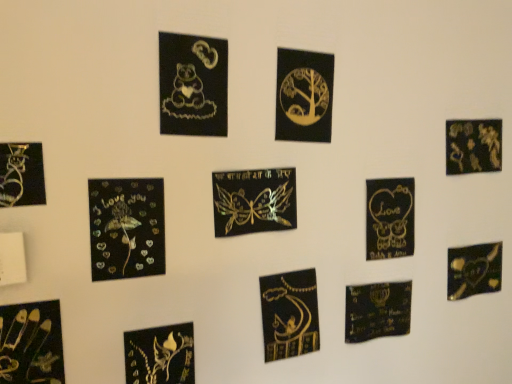
Question: Is metallic gold butterfly at lower left, the 6th picture frame from the right, looking in the opposite direction of gold metallic calligraphy at center, the second embroidery from the back?

Choices:
 (A) no
 (B) yes

Answer: (A)

Question: Is metallic gold butterfly at lower left, the fourth picture frame when ordered from left to right, aimed at gold metallic calligraphy at center, the second embroidery from the back?

Choices:
 (A) yes
 (B) no

Answer: (B)

Question: Would you consider metallic gold butterfly at lower left, the 6th picture frame from the right, to be distant from gold metallic calligraphy at center, the 2th embroidery when ordered from right to left?

Choices:
 (A) yes
 (B) no

Answer: (B)

Question: Would you say metallic gold butterfly at lower left, the fourth picture frame when ordered from left to right, contains gold metallic calligraphy at center, the second embroidery from the back?

Choices:
 (A) yes
 (B) no

Answer: (B)

Question: Can you confirm if metallic gold butterfly at lower left, the 6th picture frame from the right, is wider than gold metallic calligraphy at center, which appears as the 1th embroidery when viewed from the front?

Choices:
 (A) no
 (B) yes

Answer: (A)

Question: Is gold metallic heart at center right, positioned as the second picture frame in right-to-left order, taller or shorter than holographic gold butterflies at center, the 4th picture frame positioned from the right?

Choices:
 (A) tall
 (B) short

Answer: (A)

Question: From a real-world perspective, is gold metallic heart at center right, positioned as the second picture frame in right-to-left order, physically located above or below holographic gold butterflies at center, arranged as the sixth picture frame when viewed from the left?

Choices:
 (A) above
 (B) below

Answer: (B)

Question: In terms of size, does gold metallic heart at center right, placed as the 8th picture frame when sorted from left to right, appear bigger or smaller than holographic gold butterflies at center, the 4th picture frame positioned from the right?

Choices:
 (A) big
 (B) small

Answer: (B)

Question: Choose the correct answer: Is gold metallic heart at center right, positioned as the second picture frame in right-to-left order, inside holographic gold butterflies at center, arranged as the sixth picture frame when viewed from the left, or outside it?

Choices:
 (A) outside
 (B) inside

Answer: (A)

Question: From their relative heights in the image, would you say metallic gold floral design at upper right, which is the 9th picture frame in left-to-right order, is taller or shorter than gold metallic heart at center right, placed as the 8th picture frame when sorted from left to right?

Choices:
 (A) tall
 (B) short

Answer: (B)

Question: Considering their positions, is metallic gold floral design at upper right, the 1th picture frame when ordered from right to left, located in front of or behind gold metallic heart at center right, placed as the 8th picture frame when sorted from left to right?

Choices:
 (A) behind
 (B) front

Answer: (A)

Question: Is point (497, 147) closer or farther from the camera than point (394, 228)?

Choices:
 (A) farther
 (B) closer

Answer: (A)

Question: Do you think metallic gold floral design at upper right, which is the 9th picture frame in left-to-right order, is within gold metallic heart at center right, placed as the 8th picture frame when sorted from left to right, or outside of it?

Choices:
 (A) inside
 (B) outside

Answer: (B)

Question: From a real-world perspective, is matte black heart at lower center, the 1th embroidery from the right, above or below gold metallic tree at upper center, which ranks as the third picture frame in right-to-left order?

Choices:
 (A) below
 (B) above

Answer: (A)

Question: Is point (395, 286) positioned closer to the camera than point (278, 64)?

Choices:
 (A) closer
 (B) farther

Answer: (B)